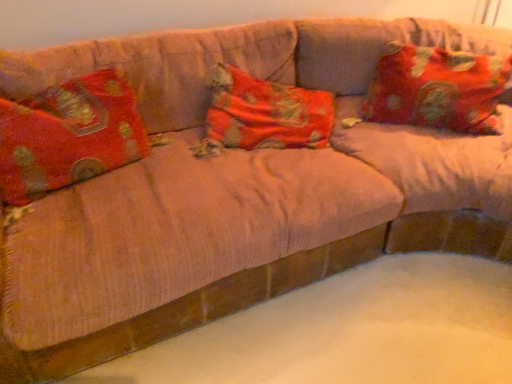
Locate an element on the screen. The height and width of the screenshot is (384, 512). floral fabric pillow at upper right is located at coordinates (437, 89).

Describe the element at coordinates (437, 89) in the screenshot. This screenshot has width=512, height=384. I see `floral fabric pillow at upper right` at that location.

You are a GUI agent. You are given a task and a screenshot of the screen. Output one action in this format:
    pyautogui.click(x=<x>, y=<y>)
    Task: Click on the floral fabric pillow at upper right
    The height and width of the screenshot is (384, 512).
    Given the screenshot: What is the action you would take?
    pyautogui.click(x=437, y=89)